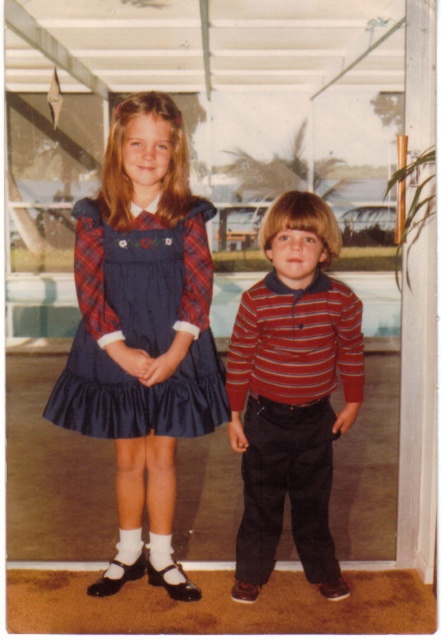
Is striped cotton shirt at center taller than navy satin dress at center?

Correct, striped cotton shirt at center is much taller as navy satin dress at center.

Does striped cotton shirt at center appear over navy satin dress at center?

Incorrect, striped cotton shirt at center is not positioned above navy satin dress at center.

What do you see at coordinates (291, 392) in the screenshot? I see `striped cotton shirt at center` at bounding box center [291, 392].

Find the location of a particular element. This screenshot has height=640, width=441. striped cotton shirt at center is located at coordinates (291, 392).

From the picture: Between matte blue dress at center and navy satin dress at center, which one is positioned higher?

navy satin dress at center is higher up.

Is matte blue dress at center below navy satin dress at center?

Correct, matte blue dress at center is located below navy satin dress at center.

Between point (48, 410) and point (183, 300), which one is positioned behind?

Positioned behind is point (183, 300).

Locate an element on the screen. The height and width of the screenshot is (640, 441). matte blue dress at center is located at coordinates (142, 332).

Can you confirm if matte blue dress at center is thinner than striped cotton shirt at center?

Incorrect, matte blue dress at center's width is not less than striped cotton shirt at center's.

Where is `matte blue dress at center`? The image size is (441, 640). matte blue dress at center is located at coordinates (142, 332).